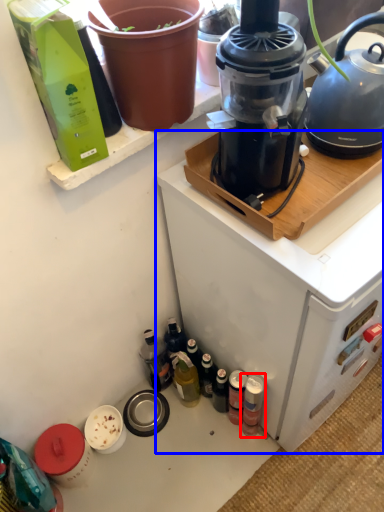
Question: Which of the following is the farthest to the observer, bottle (highlighted by a red box) or appliance (highlighted by a blue box)?

Choices:
 (A) bottle
 (B) appliance

Answer: (A)